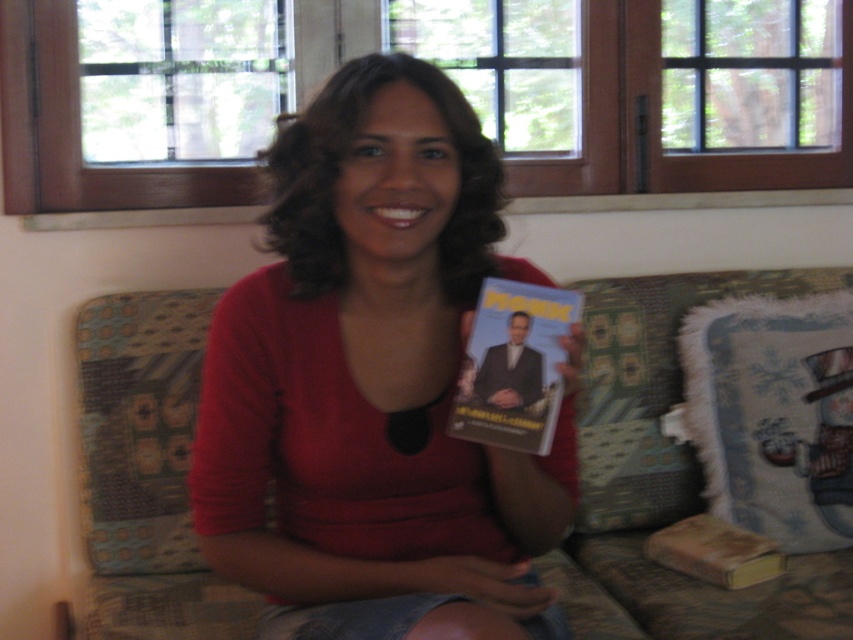
Who is lower down, white fluffy pillow at upper right or white glossy dvd at center?

Positioned lower is white fluffy pillow at upper right.

Does white fluffy pillow at upper right appear over white glossy dvd at center?

No, white fluffy pillow at upper right is not above white glossy dvd at center.

Where is `white fluffy pillow at upper right`? The image size is (853, 640). white fluffy pillow at upper right is located at coordinates (772, 413).

What do you see at coordinates (669, 476) in the screenshot? I see `patterned fabric couch at center` at bounding box center [669, 476].

Is point (212, 628) positioned after point (682, 550)?

That is False.

Who is more distant from viewer, (x=601, y=632) or (x=717, y=538)?

Point (x=717, y=538)

Find the location of `patterned fabric couch at center`. patterned fabric couch at center is located at coordinates (669, 476).

Which is above, matte red shirt at center or brown leather book at lower right?

matte red shirt at center

Is point (515, 576) positioned in front of point (705, 554)?

Yes, point (515, 576) is closer to viewer.

Where is `matte red shirt at center`? Image resolution: width=853 pixels, height=640 pixels. matte red shirt at center is located at coordinates (373, 384).